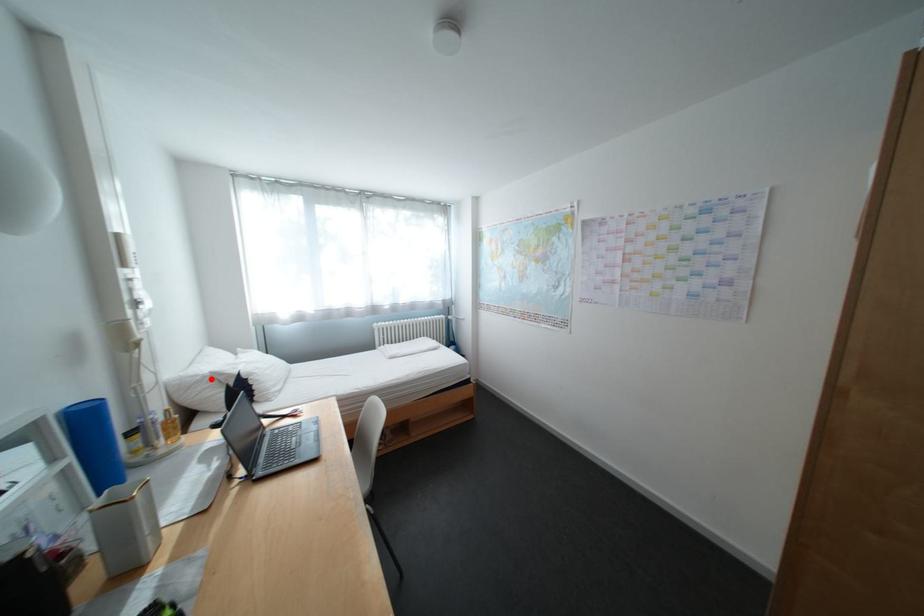
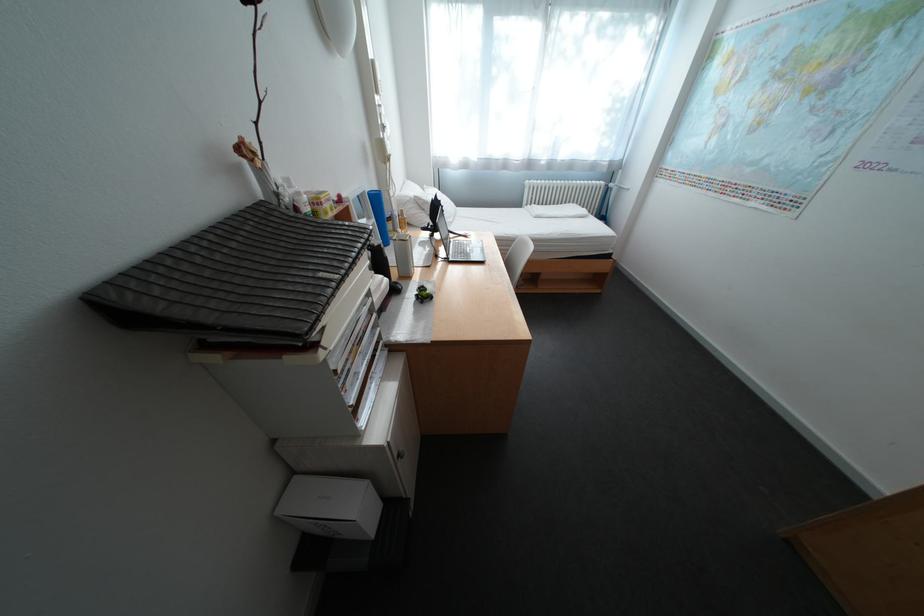
Question: I am providing you with two images of the same scene from different viewpoints. A red point is marked on the first image. At the location where the point appears in image 1, is it still visible in image 2?

Choices:
 (A) Yes
 (B) No

Answer: (A)